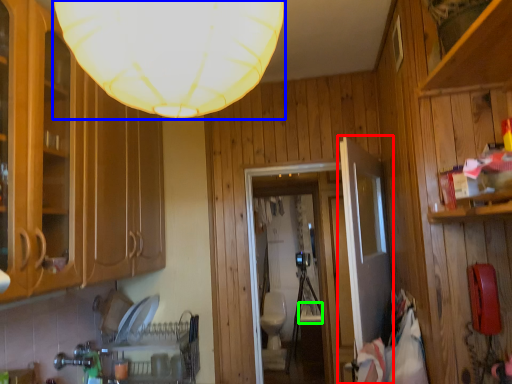
Question: Considering the real-world distances, which object is closest to door (highlighted by a red box)? lamp (highlighted by a blue box) or sink (highlighted by a green box).

Choices:
 (A) lamp
 (B) sink

Answer: (A)